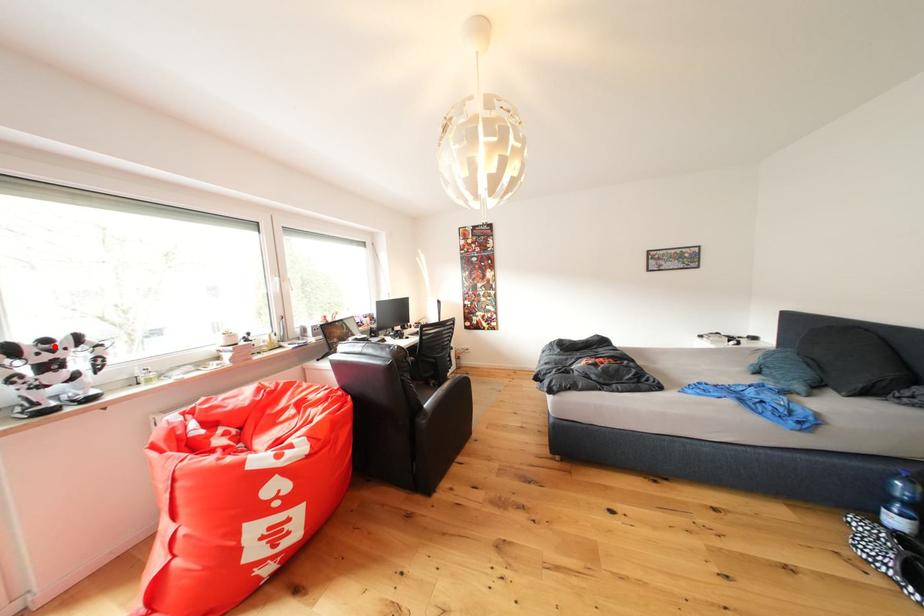
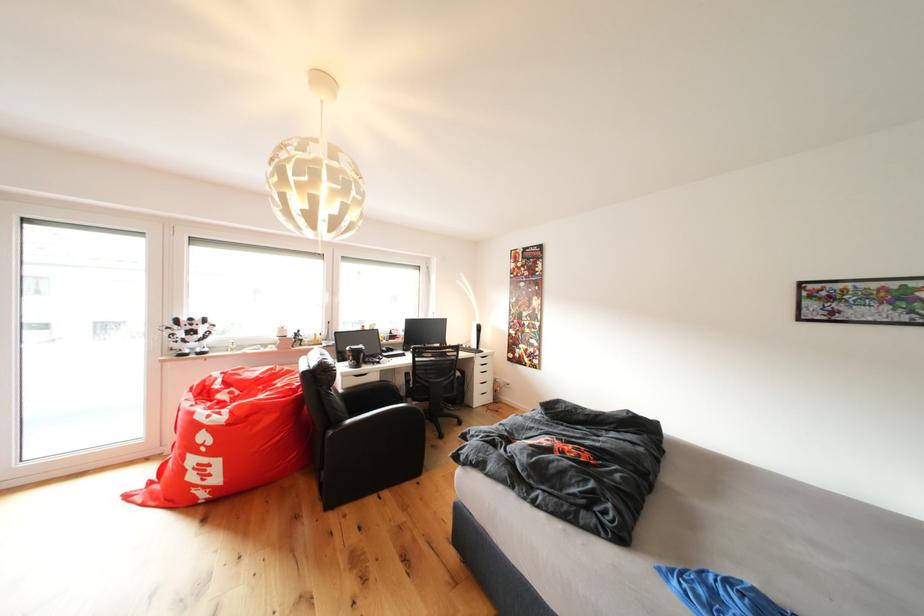
In the second image, find the point that corresponds to the highlighted location in the first image.

(200, 323)